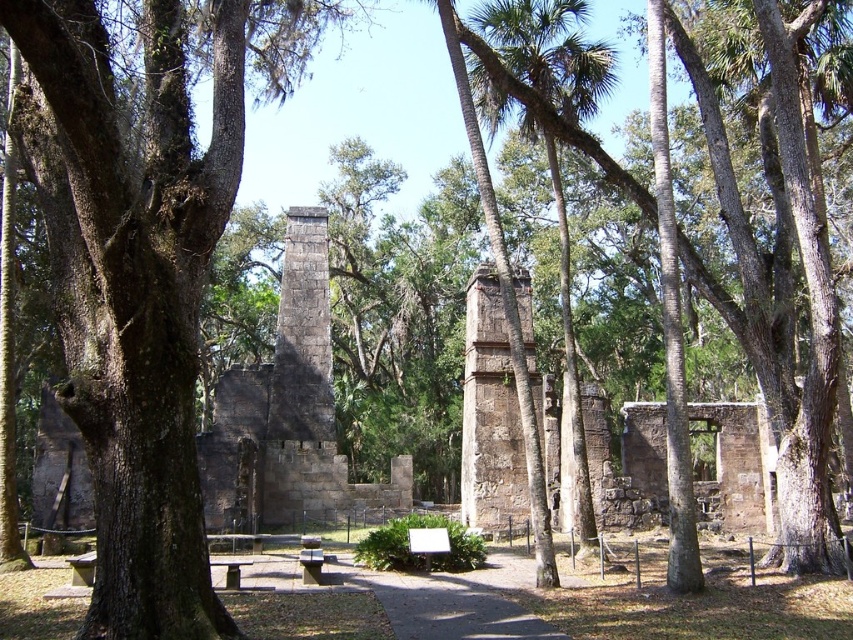
Question: Is green rough bark tree at left to the left of stone ruins at center from the viewer's perspective?

Choices:
 (A) yes
 (B) no

Answer: (B)

Question: Among these objects, which one is nearest to the camera?

Choices:
 (A) stone ruins at center
 (B) green rough bark tree at left

Answer: (B)

Question: Does green rough bark tree at left have a smaller size compared to stone ruins at center?

Choices:
 (A) no
 (B) yes

Answer: (A)

Question: Which point is closer to the camera?

Choices:
 (A) (325, 300)
 (B) (233, 147)

Answer: (B)

Question: Does green rough bark tree at left have a larger size compared to stone ruins at center?

Choices:
 (A) yes
 (B) no

Answer: (A)